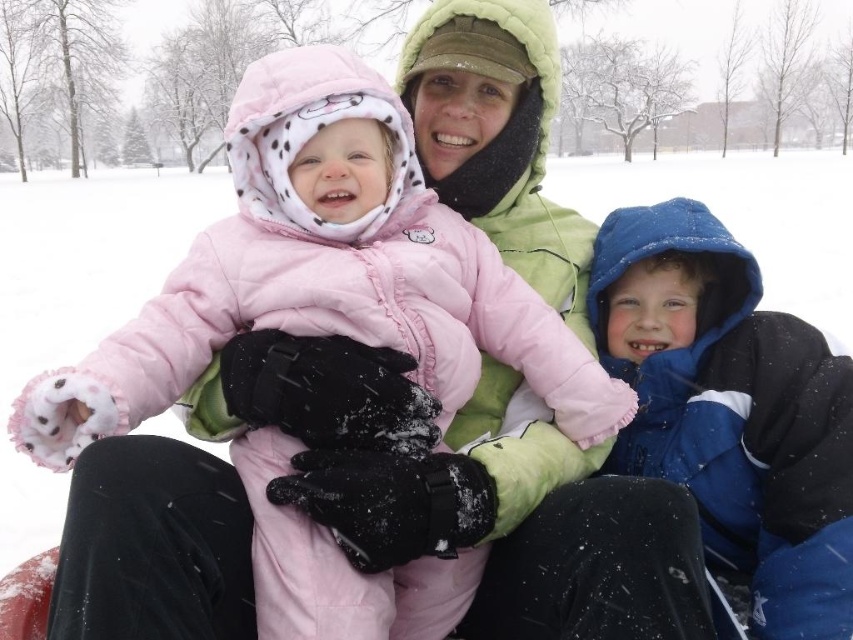
You are helping a parent locate their two children in the snow. The parent says the younger child is wearing a matte pink coat at center and the older is in a blue fleece jacket at right. Based on the scene, which child is sitting closer to the left side?

The matte pink coat at center is to the left of blue fleece jacket at right, so the younger child in the matte pink coat at center is sitting closer to the left side.